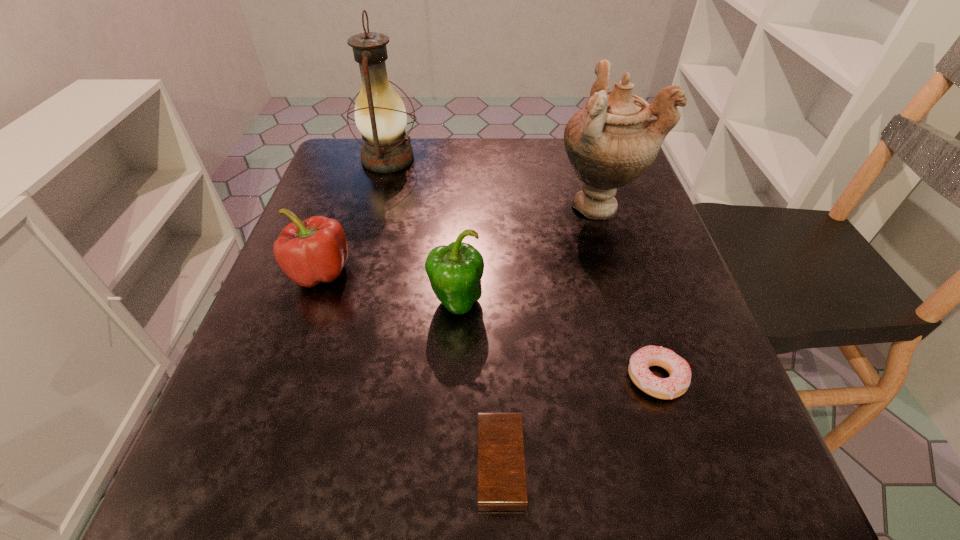
Where is `object positioned at the near edge`? This screenshot has height=540, width=960. object positioned at the near edge is located at coordinates (502, 486).

Locate an element on the screen. oil lamp that is at the left edge is located at coordinates (380, 115).

You are a GUI agent. You are given a task and a screenshot of the screen. Output one action in this format:
    pyautogui.click(x=<x>, y=<y>)
    Task: Click on the bell pepper that is at the left edge
    This screenshot has height=540, width=960.
    Given the screenshot: What is the action you would take?
    pyautogui.click(x=309, y=252)

Find the location of a particular element. The height and width of the screenshot is (540, 960). urn at the right edge is located at coordinates (612, 141).

The height and width of the screenshot is (540, 960). In order to click on doughnut situated at the right edge in this screenshot , I will do point(678,368).

Locate an element on the screen. object that is at the far left corner is located at coordinates (380, 115).

At what (x,y) coordinates should I click in order to perform the action: click on object at the far right corner. Please return your answer as a coordinate pair (x, y). Looking at the image, I should click on (612, 141).

The image size is (960, 540). I want to click on free location at the far edge, so click(512, 151).

Locate an element on the screen. The image size is (960, 540). free spot at the left edge of the desktop is located at coordinates (332, 401).

Identify the location of vacant space at the right edge of the desktop. The width and height of the screenshot is (960, 540). (639, 407).